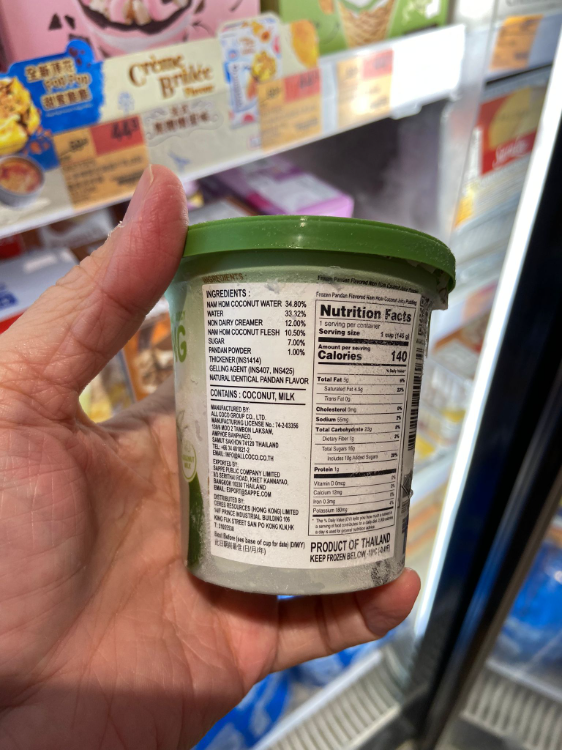
Locate an element on the screen. glass of freezer door is located at coordinates (533, 566).